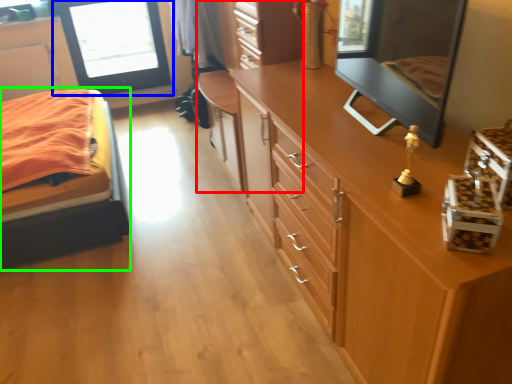
Question: Considering the real-world distances, which object is closest to dresser (highlighted by a red box)? window screen (highlighted by a blue box) or bed (highlighted by a green box).

Choices:
 (A) window screen
 (B) bed

Answer: (B)